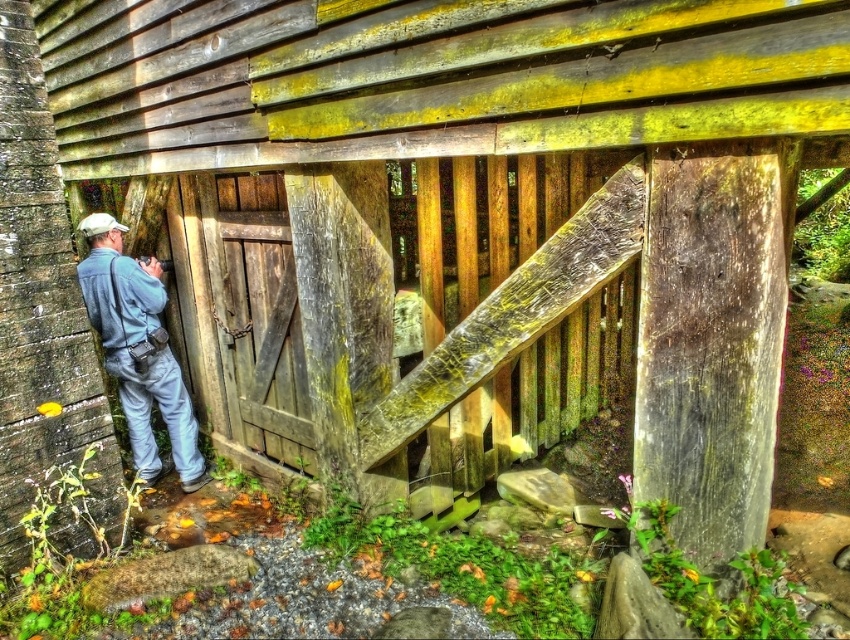
Is weathered wood barn door at center wider than blue denim jumpsuit at left?

Indeed, weathered wood barn door at center has a greater width compared to blue denim jumpsuit at left.

This screenshot has height=640, width=850. What are the coordinates of `weathered wood barn door at center` in the screenshot? It's located at (242, 314).